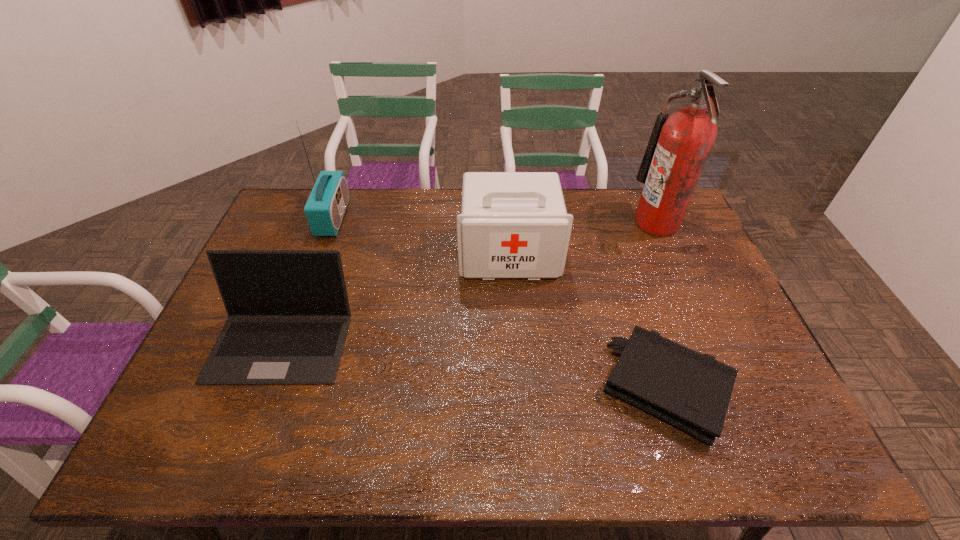
At what (x,y) coordinates should I click in order to perform the action: click on free space between the third object from right to left and the fourth shortest object. Please return your answer as a coordinate pair (x, y). Looking at the image, I should click on (421, 235).

In order to click on unoccupied area between the laptop and the first-aid kit in this screenshot , I will do `click(396, 297)`.

Image resolution: width=960 pixels, height=540 pixels. Find the location of `free space between the Bible and the tallest object`. free space between the Bible and the tallest object is located at coordinates (661, 305).

Where is `free space between the laptop and the shortest object`? free space between the laptop and the shortest object is located at coordinates (474, 364).

Identify which object is the third nearest to the first-aid kit. Please provide its 2D coordinates. Your answer should be formatted as a tuple, i.e. [(x, y)], where the tuple contains the x and y coordinates of a point satisfying the conditions above.

[(288, 312)]

Locate which object ranks second in proximity to the Bible. Please provide its 2D coordinates. Your answer should be formatted as a tuple, i.e. [(x, y)], where the tuple contains the x and y coordinates of a point satisfying the conditions above.

[(678, 148)]

This screenshot has width=960, height=540. In order to click on free space that satisfies the following two spatial constraints: 1. on the front of the tallest object near the operation label; 2. on the front-facing side of the third tallest object in this screenshot , I will do `click(670, 254)`.

Image resolution: width=960 pixels, height=540 pixels. Identify the location of free space that satisfies the following two spatial constraints: 1. on the front panel of the shortest object; 2. on the left side of the radio receiver. (271, 387).

Find the location of a particular element. This screenshot has width=960, height=540. vacant space that satisfies the following two spatial constraints: 1. on the front panel of the radio receiver; 2. on the screen of the second shortest object is located at coordinates (288, 341).

In order to click on vacant space that satisfies the following two spatial constraints: 1. on the front panel of the fourth shortest object; 2. on the screen of the fourth tallest object in this screenshot , I will do `click(288, 341)`.